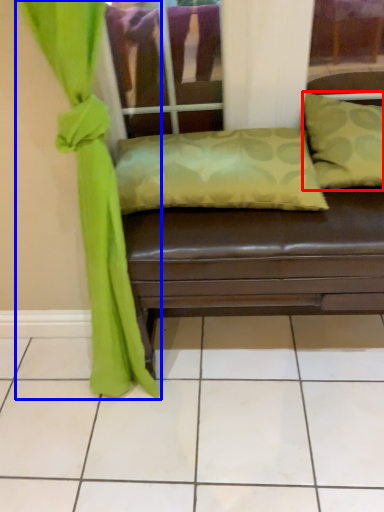
Question: Among these objects, which one is farthest to the camera, pillow (highlighted by a red box) or curtain (highlighted by a blue box)?

Choices:
 (A) pillow
 (B) curtain

Answer: (A)